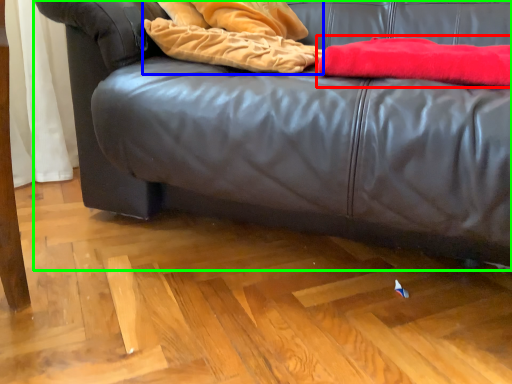
Question: Based on their relative distances, which object is nearer to blanket (highlighted by a red box)? Choose from blanket (highlighted by a blue box) and studio couch (highlighted by a green box).

Choices:
 (A) blanket
 (B) studio couch

Answer: (A)